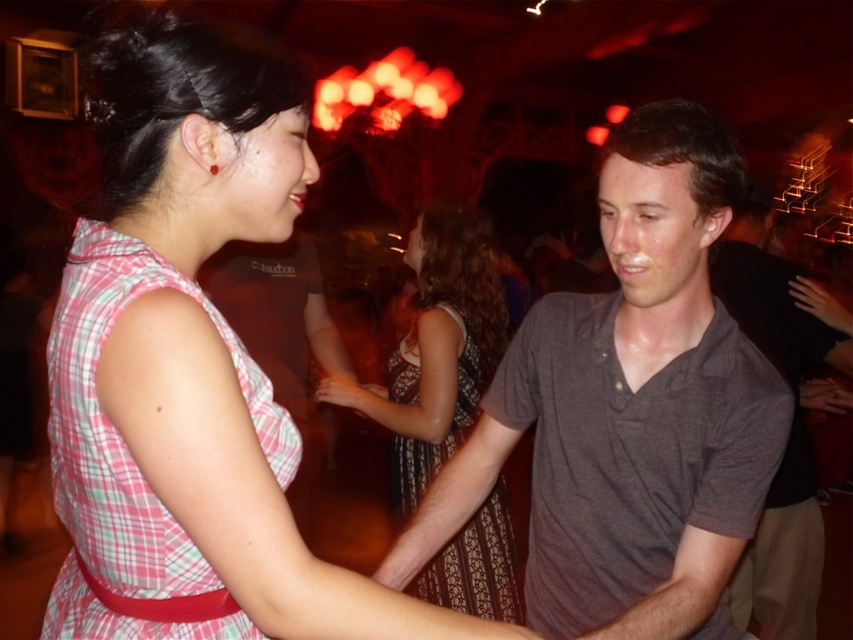
Between pink plaid dress at center and gray cotton shirt at center, which one has less height?

With less height is pink plaid dress at center.

Between point (190, 253) and point (616, 568), which one is positioned behind?

The point (616, 568) is more distant.

Between point (181, 262) and point (614, 172), which one is positioned in front?

Point (181, 262) is more forward.

You are a GUI agent. You are given a task and a screenshot of the screen. Output one action in this format:
    pyautogui.click(x=<x>, y=<y>)
    Task: Click on the pink plaid dress at center
    The height and width of the screenshot is (640, 853).
    Given the screenshot: What is the action you would take?
    pyautogui.click(x=190, y=365)

Does pink plaid dress at left have a greater height compared to dark gray cotton shirt at center?

No.

Does pink plaid dress at left have a lesser width compared to dark gray cotton shirt at center?

Yes, pink plaid dress at left is thinner than dark gray cotton shirt at center.

Which is in front, point (216, 636) or point (761, 262)?

Point (216, 636)

Find the location of a particular element. The width and height of the screenshot is (853, 640). pink plaid dress at left is located at coordinates (131, 456).

Can you confirm if gray cotton shirt at center is wider than pink plaid dress at left?

Yes, gray cotton shirt at center is wider than pink plaid dress at left.

Is gray cotton shirt at center to the right of pink plaid dress at left from the viewer's perspective?

Yes, gray cotton shirt at center is to the right of pink plaid dress at left.

Find the location of a particular element. The image size is (853, 640). gray cotton shirt at center is located at coordinates (630, 410).

Identify the location of gray cotton shirt at center. Image resolution: width=853 pixels, height=640 pixels. (630, 410).